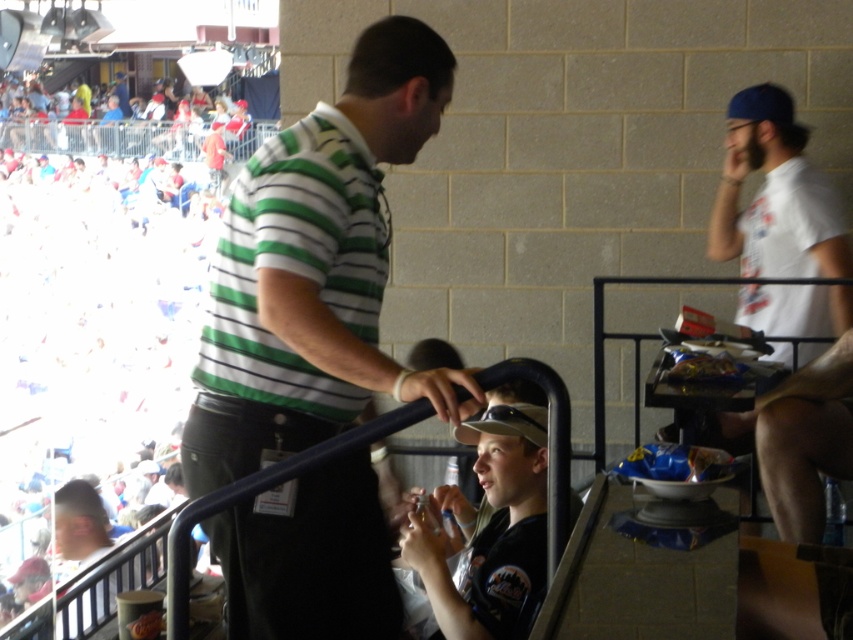
Does white plastic cups at upper left have a greater height compared to khaki fabric cap at center?

Indeed, white plastic cups at upper left has a greater height compared to khaki fabric cap at center.

Does white plastic cups at upper left appear under khaki fabric cap at center?

Actually, white plastic cups at upper left is above khaki fabric cap at center.

Does point (161, 438) come farther from viewer compared to point (410, 564)?

Yes, it is behind point (410, 564).

Find the location of a particular element. This screenshot has height=640, width=853. white plastic cups at upper left is located at coordinates [90, 387].

Consider the image. Can you confirm if green striped shirt at center is thinner than khaki fabric cap at center?

In fact, green striped shirt at center might be wider than khaki fabric cap at center.

Is point (285, 513) farther from viewer compared to point (467, 424)?

That is False.

Find the location of a particular element. The image size is (853, 640). green striped shirt at center is located at coordinates (314, 268).

Does green striped shirt at center have a smaller size compared to white plastic cups at upper left?

Correct, green striped shirt at center occupies less space than white plastic cups at upper left.

Can you confirm if green striped shirt at center is wider than white plastic cups at upper left?

In fact, green striped shirt at center might be narrower than white plastic cups at upper left.

Does point (393, 24) come in front of point (19, 406)?

Yes.

Identify the location of green striped shirt at center. This screenshot has width=853, height=640. point(314,268).